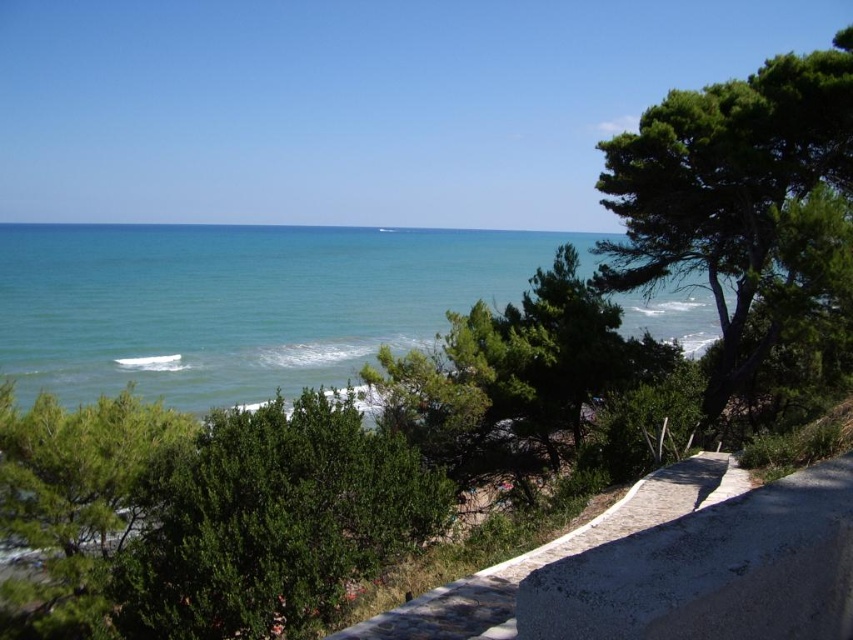
Between point (363, 230) and point (183, 595), which one is positioned behind?

The point (363, 230) is behind.

Which of these two, blue water at center or green leafy bush at center, stands taller?

With more height is blue water at center.

The height and width of the screenshot is (640, 853). In order to click on blue water at center in this screenshot , I will do `click(239, 304)`.

Who is higher up, blue water at center or green textured tree at right?

Result: blue water at center is above.

Which of these two, blue water at center or green textured tree at right, stands taller?

With more height is blue water at center.

Which is in front, point (396, 273) or point (830, 56)?

Point (830, 56) is in front.

What are the coordinates of `blue water at center` in the screenshot? It's located at (239, 304).

Is green leafy bush at center smaller than green textured tree at right?

Correct, green leafy bush at center occupies less space than green textured tree at right.

Between green leafy bush at center and green textured tree at right, which one has more height?

Standing taller between the two is green textured tree at right.

The image size is (853, 640). I want to click on green leafy bush at center, so click(x=271, y=522).